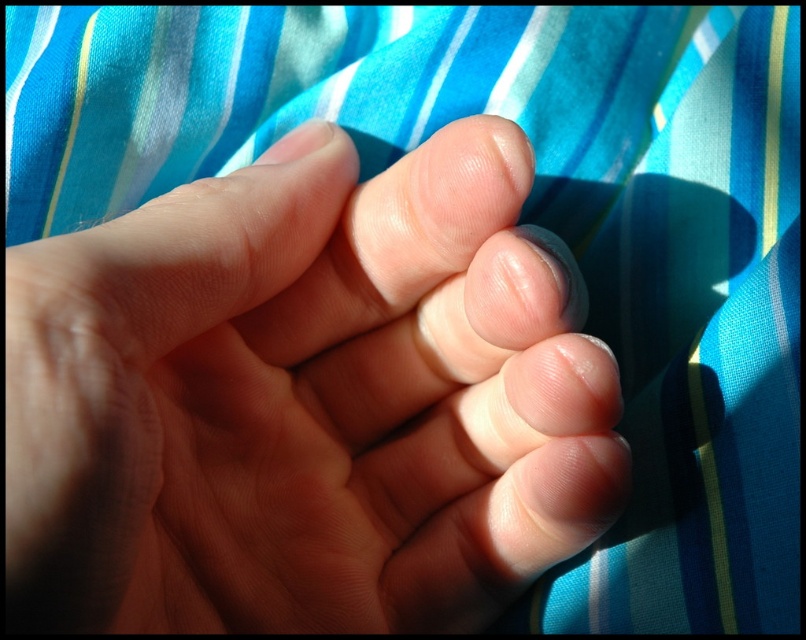
You are a photographer trying to position a hand in a photo. The scene has a fabric with horizontal stripes in the background. Where should you place the smooth skin hand at center to ensure it is centered in the frame?

The smooth skin hand at center should be placed at the 2D coordinates point (305, 401) to ensure it is centered in the frame according to the scene description.

You are a photographer trying to capture a closeup of the smooth skin hand at center and the smooth skin toe at center. Based on their positions, which one is closer to the bottom edge of the photo?

The smooth skin hand at center is below smooth skin toe at center, so the smooth skin hand at center is closer to the bottom edge of the photo.